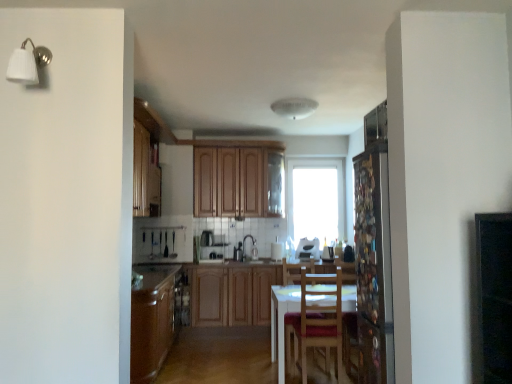
Question: Is white glossy toaster at center, the second appliance when ordered from left to right, positioned before white glossy sink at center?

Choices:
 (A) yes
 (B) no

Answer: (B)

Question: Is the depth of white glossy toaster at center, which is the 1th appliance from right to left, greater than that of white glossy sink at center?

Choices:
 (A) no
 (B) yes

Answer: (B)

Question: Is there a large distance between white glossy toaster at center, which is the 1th appliance from right to left, and white glossy sink at center?

Choices:
 (A) no
 (B) yes

Answer: (A)

Question: Would you say white glossy toaster at center, the second appliance when ordered from left to right, contains white glossy sink at center?

Choices:
 (A) yes
 (B) no

Answer: (B)

Question: Considering the relative sizes of white glossy toaster at center, the second appliance when ordered from left to right, and white glossy sink at center in the image provided, is white glossy toaster at center, the second appliance when ordered from left to right, taller than white glossy sink at center?

Choices:
 (A) yes
 (B) no

Answer: (B)

Question: Considering the positions of wooden chair at center and white glossy toaster at center, which is the 1th appliance from right to left, in the image, is wooden chair at center wider or thinner than white glossy toaster at center, which is the 1th appliance from right to left,?

Choices:
 (A) thin
 (B) wide

Answer: (B)

Question: Is point (298, 344) positioned closer to the camera than point (297, 251)?

Choices:
 (A) closer
 (B) farther

Answer: (A)

Question: Based on their positions, is wooden chair at center located to the left or right of white glossy toaster at center, which is the 1th appliance from right to left?

Choices:
 (A) left
 (B) right

Answer: (A)

Question: In the image, is wooden chair at center positioned in front of or behind white glossy toaster at center, which is the 1th appliance from right to left?

Choices:
 (A) front
 (B) behind

Answer: (A)

Question: Considering the positions of point (200, 249) and point (241, 291), is point (200, 249) closer or farther from the camera than point (241, 291)?

Choices:
 (A) farther
 (B) closer

Answer: (A)

Question: Based on their positions, is matte white microwave at center, the second appliance in the right-to-left sequence, located to the left or right of wooden cabinets at center, the second cabinetry positioned from the top?

Choices:
 (A) right
 (B) left

Answer: (B)

Question: Considering the positions of matte white microwave at center, the second appliance in the right-to-left sequence, and wooden cabinets at center, placed as the first cabinetry when sorted from bottom to top, in the image, is matte white microwave at center, the second appliance in the right-to-left sequence, wider or thinner than wooden cabinets at center, placed as the first cabinetry when sorted from bottom to top,?

Choices:
 (A) thin
 (B) wide

Answer: (A)

Question: Is matte white microwave at center, which appears as the first appliance when viewed from the left, inside or outside of wooden cabinets at center, the second cabinetry positioned from the top?

Choices:
 (A) outside
 (B) inside

Answer: (A)

Question: Considering the positions of matte brown countertop at lower left and wooden cabinets at center, the second cabinetry positioned from the top, in the image, is matte brown countertop at lower left taller or shorter than wooden cabinets at center, the second cabinetry positioned from the top,?

Choices:
 (A) short
 (B) tall

Answer: (A)

Question: From a real-world perspective, is matte brown countertop at lower left physically located above or below wooden cabinets at center, placed as the first cabinetry when sorted from bottom to top?

Choices:
 (A) below
 (B) above

Answer: (B)